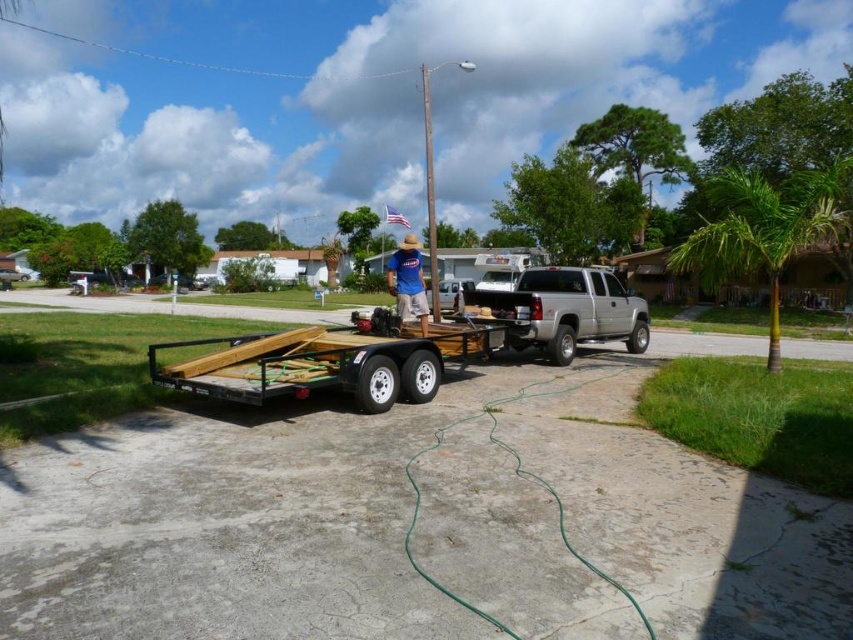
Is metallic silver trailer at center closer to the viewer compared to blue cotton shirt at center?

Yes, it is in front of blue cotton shirt at center.

Who is taller, metallic silver trailer at center or blue cotton shirt at center?

blue cotton shirt at center

Is point (299, 381) in front of point (390, 272)?

Yes, it is in front of point (390, 272).

Where is `metallic silver trailer at center`? This screenshot has width=853, height=640. metallic silver trailer at center is located at coordinates (306, 365).

Is point (532, 272) behind point (399, 278)?

Yes, it is behind point (399, 278).

Measure the distance between silver metallic pickup truck at center and blue cotton shirt at center.

4.38 meters

In order to click on silver metallic pickup truck at center in this screenshot , I will do `click(566, 310)`.

Is metallic silver trailer at center positioned behind silver metallic pickup truck at center?

No, metallic silver trailer at center is in front of silver metallic pickup truck at center.

How much distance is there between metallic silver trailer at center and silver metallic pickup truck at center?

metallic silver trailer at center is 4.42 meters from silver metallic pickup truck at center.

Does point (386, 356) come farther from viewer compared to point (578, 289)?

That is False.

You are a GUI agent. You are given a task and a screenshot of the screen. Output one action in this format:
    pyautogui.click(x=<x>, y=<y>)
    Task: Click on the metallic silver trailer at center
    
    Given the screenshot: What is the action you would take?
    pyautogui.click(x=306, y=365)